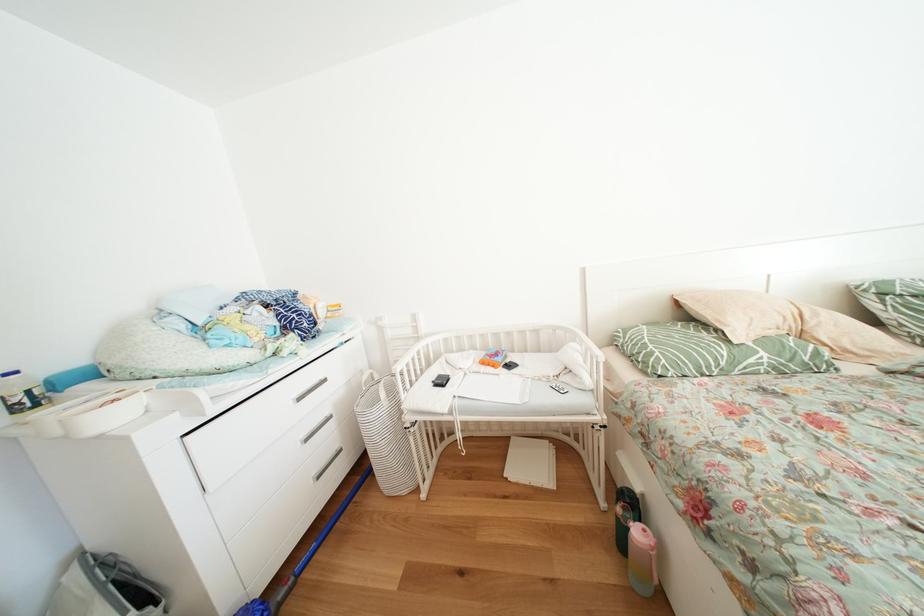
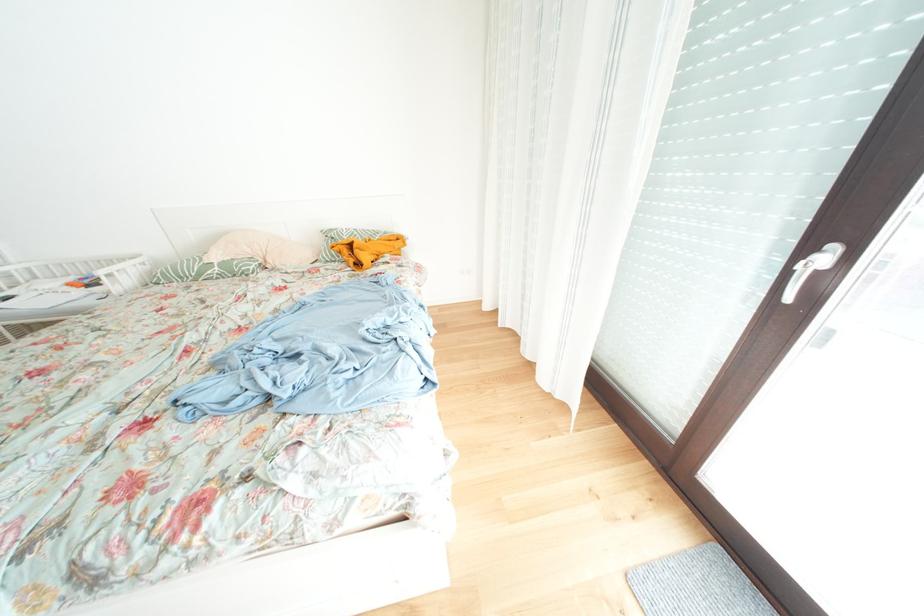
Which direction would the cameraman need to move to produce the second image?

The movement direction of the cameraman is right, backward.